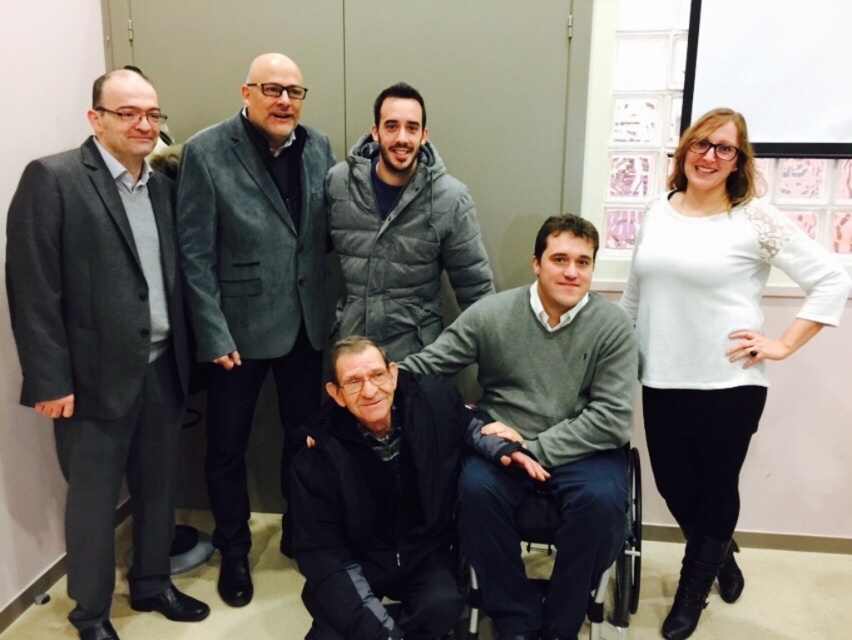
Is point (504, 403) positioned before point (522, 540)?

No.

You are a GUI agent. You are given a task and a screenshot of the screen. Output one action in this format:
    pyautogui.click(x=<x>, y=<y>)
    Task: Click on the gray sweater at center
    Image resolution: width=852 pixels, height=640 pixels.
    Given the screenshot: What is the action you would take?
    pyautogui.click(x=544, y=428)

Who is lower down, white lace sweater at upper right or gray puffy jacket at center?

Positioned lower is white lace sweater at upper right.

I want to click on white lace sweater at upper right, so click(712, 339).

What do you see at coordinates (712, 339) in the screenshot?
I see `white lace sweater at upper right` at bounding box center [712, 339].

In order to click on white lace sweater at upper right in this screenshot , I will do `click(712, 339)`.

Is the position of velvet blazer at upper left less distant than that of black plastic wheelchair at lower center?

No, it is not.

Can you confirm if velvet blazer at upper left is positioned to the left of black plastic wheelchair at lower center?

Yes, velvet blazer at upper left is to the left of black plastic wheelchair at lower center.

Who is more distant from viewer, (227, 262) or (476, 616)?

The point (227, 262) is behind.

Where is `velvet blazer at upper left`? This screenshot has height=640, width=852. velvet blazer at upper left is located at coordinates (254, 288).